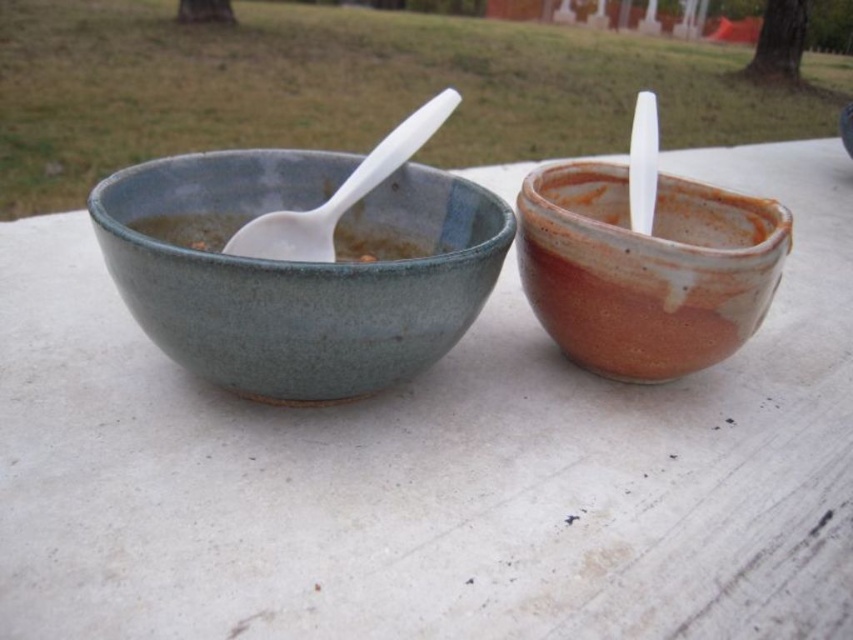
You are at a picnic and need to choose a bowl to eat soup from. The matte ceramic bowl at left and the matte clay bowl at right are available. Which bowl has a larger width?

The matte ceramic bowl at left has a larger width than the matte clay bowl at right.

You are at a picnic table and want to choose a bowl that can hold more liquid. Which bowl between the matte ceramic bowl at left and the matte ceramic soup at left is taller?

The matte ceramic bowl at left is much taller than the matte ceramic soup at left, so it can hold more liquid.

You are a person sitting at the table looking at the two bowls. Which object is closer to you between the white plastic spoon at left and the matte ceramic soup at left?

The white plastic spoon at left is closer to the viewer than the matte ceramic soup at left.